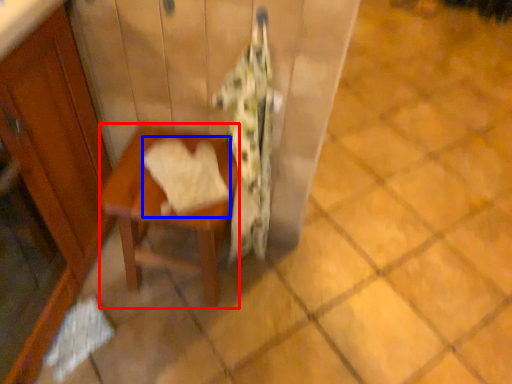
Question: Which object appears farthest to the camera in this image, table (highlighted by a red box) or bath towel (highlighted by a blue box)?

Choices:
 (A) table
 (B) bath towel

Answer: (A)